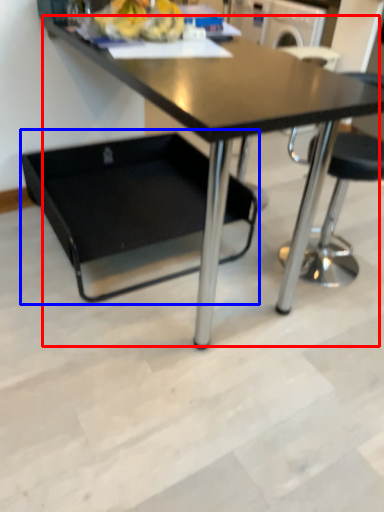
Question: Which of the following is the closest to the observer, table (highlighted by a red box) or swivel chair (highlighted by a blue box)?

Choices:
 (A) table
 (B) swivel chair

Answer: (A)